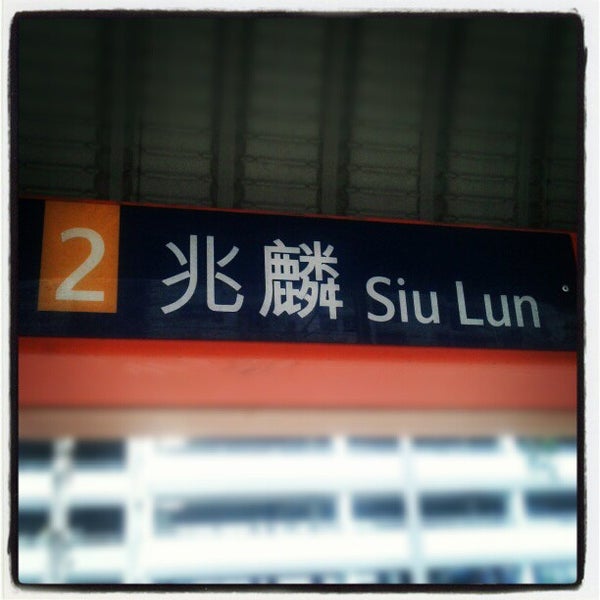
Where is `upper part of back wall`? This screenshot has height=600, width=600. upper part of back wall is located at coordinates (358, 26).